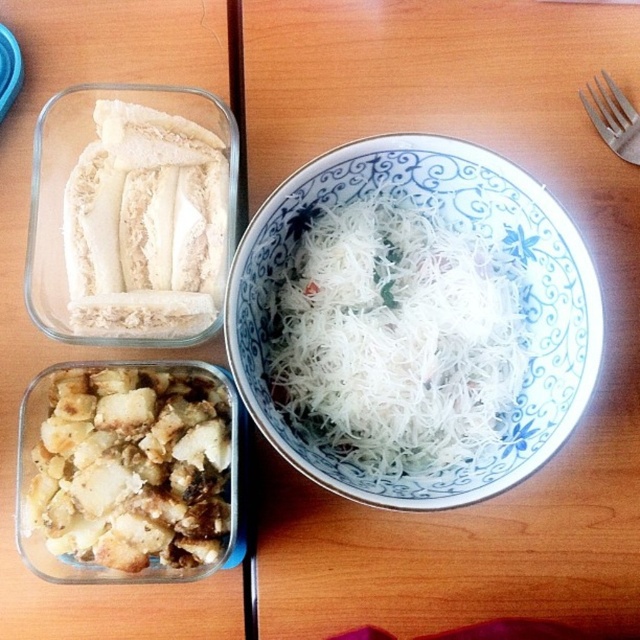
How distant is white porcelain noodles at center from brown crumbly bread at bottom left?

white porcelain noodles at center and brown crumbly bread at bottom left are 25.96 centimeters apart from each other.

Does white porcelain noodles at center have a greater height compared to brown crumbly bread at bottom left?

Yes.

You are a GUI agent. You are given a task and a screenshot of the screen. Output one action in this format:
    pyautogui.click(x=<x>, y=<y>)
    Task: Click on the white porcelain noodles at center
    
    Given the screenshot: What is the action you would take?
    pyautogui.click(x=472, y=236)

Is point (124, 120) closer to viewer compared to point (596, 120)?

Yes, point (124, 120) is closer to viewer.

Who is lower down, white fluffy bread at upper left or silver metallic fork at upper right?

white fluffy bread at upper left is below.

Between point (180, 147) and point (624, 104), which one is positioned behind?

The point (624, 104) is more distant.

Locate an element on the screen. white fluffy bread at upper left is located at coordinates (145, 225).

The image size is (640, 640). What do you see at coordinates (472, 236) in the screenshot?
I see `white porcelain noodles at center` at bounding box center [472, 236].

How much distance is there between white porcelain noodles at center and silver metallic fork at upper right?

white porcelain noodles at center and silver metallic fork at upper right are 15.74 inches apart from each other.

What do you see at coordinates (472, 236) in the screenshot? I see `white porcelain noodles at center` at bounding box center [472, 236].

Identify the location of white porcelain noodles at center. Image resolution: width=640 pixels, height=640 pixels. (472, 236).